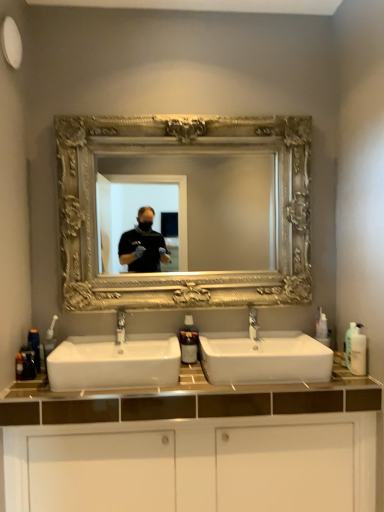
Question: From a real-world perspective, is gold ornate mirror at center physically located above or below white plastic bottle at right, arranged as the 3th toiletry when viewed from the left?

Choices:
 (A) above
 (B) below

Answer: (A)

Question: Considering the positions of point (66, 120) and point (352, 329), is point (66, 120) closer or farther from the camera than point (352, 329)?

Choices:
 (A) closer
 (B) farther

Answer: (B)

Question: Which object is positioned farthest from the white glossy cabinet at lower center?

Choices:
 (A) translucent plastic bottle at lower left, the second toiletry when ordered from right to left
 (B) matte silver faucet at center, acting as the 2th tap starting from the right
 (C) white ceramic sink at center, which is the first sink in right-to-left order
 (D) silver metallic tap at center, which is the 2th tap from left to right
 (E) blue plastic bottle at lower left, the 1th toiletry when ordered from left to right

Answer: (E)

Question: Considering the real-world distances, which object is farthest from the white glossy cabinet at lower center?

Choices:
 (A) white ceramic sink at center, acting as the 1th sink starting from the left
 (B) translucent plastic bottle at lower left, the second toiletry when ordered from right to left
 (C) blue plastic bottle at lower left, the 1th toiletry when ordered from left to right
 (D) white plastic bottle at right, arranged as the 3th toiletry when viewed from the left
 (E) white ceramic sink at center, marked as the second sink in a left-to-right arrangement

Answer: (C)